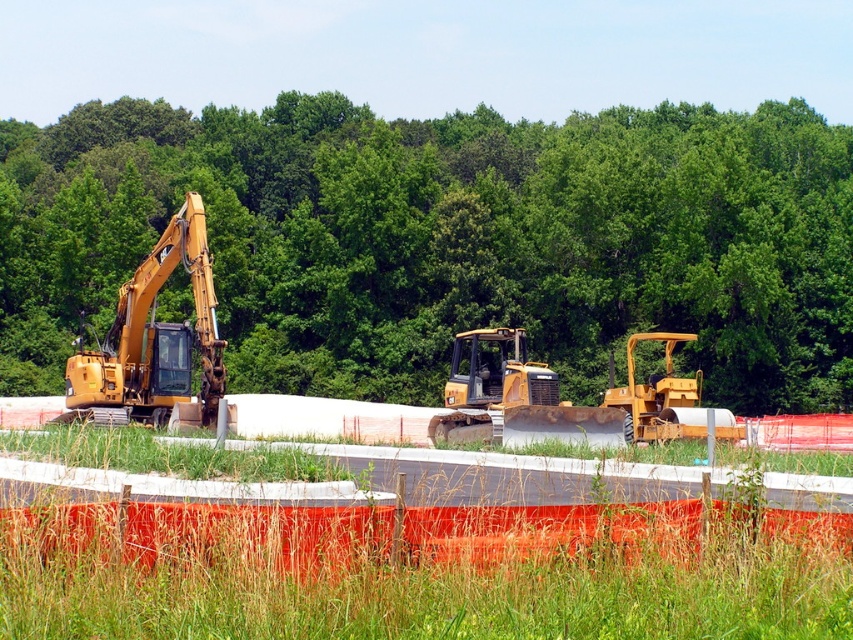
Can you confirm if yellow metallic bulldozer at center is positioned to the left of yellow rubber tractor at right?

Correct, you'll find yellow metallic bulldozer at center to the left of yellow rubber tractor at right.

How much distance is there between yellow metallic bulldozer at center and yellow rubber tractor at right?

A distance of 12.27 meters exists between yellow metallic bulldozer at center and yellow rubber tractor at right.

Who is more distant from viewer, (161,458) or (734,429)?

The point (734,429) is more distant.

At what (x,y) coordinates should I click in order to perform the action: click on yellow metallic bulldozer at center. Please return your answer as a coordinate pair (x, y). This screenshot has height=640, width=853. Looking at the image, I should click on (421, 566).

Is point (811, 257) closer to camera compared to point (119, 342)?

No, it is not.

Is green leafy trees at upper center to the left of yellow metallic excavator at left from the viewer's perspective?

Yes, green leafy trees at upper center is to the left of yellow metallic excavator at left.

Who is more forward, [393,212] or [90,380]?

Point [90,380]

Image resolution: width=853 pixels, height=640 pixels. I want to click on green leafy trees at upper center, so point(445,241).

Which is above, yellow metallic bulldozer at center or yellow metallic excavator at left?

Positioned higher is yellow metallic excavator at left.

Is yellow metallic bulldozer at center smaller than yellow metallic excavator at left?

Correct, yellow metallic bulldozer at center occupies less space than yellow metallic excavator at left.

Measure the distance between point (277,584) and camera.

Point (277,584) is 7.45 meters away from camera.

The height and width of the screenshot is (640, 853). In order to click on yellow metallic bulldozer at center in this screenshot , I will do `click(421, 566)`.